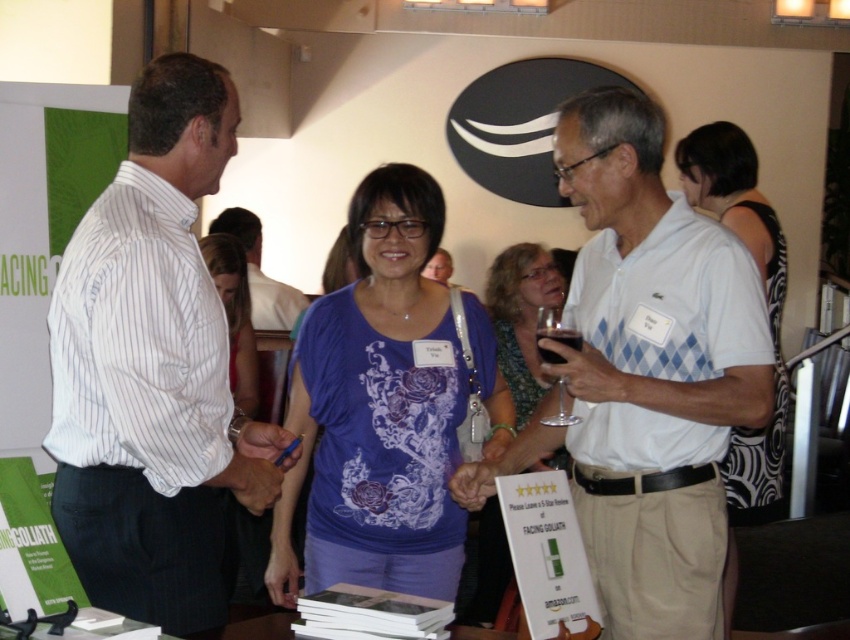
You are organizing a photo shoot and need to arrange two models wearing the blue printed shirt at center and the purple printed shirt at center. Based on their clothing widths, which model should stand on the left to create a balanced composition?

The blue printed shirt at center is wider than the purple printed shirt at center. To create a balanced composition, place the wider blue printed shirt at center on the left so that the visual weight is distributed evenly.

You are a photographer at the event and need to capture a group photo of the blue printed shirt at center and the purple printed shirt at center. The camera you are using has a minimum focus distance of 1 meter. Can you take the photo without moving either of them?

The distance between the blue printed shirt at center and purple printed shirt at center is 1.02 meters. Since the camera requires a minimum focus distance of 1 meter, the photographer can take the photo without moving them as the distance is sufficient.